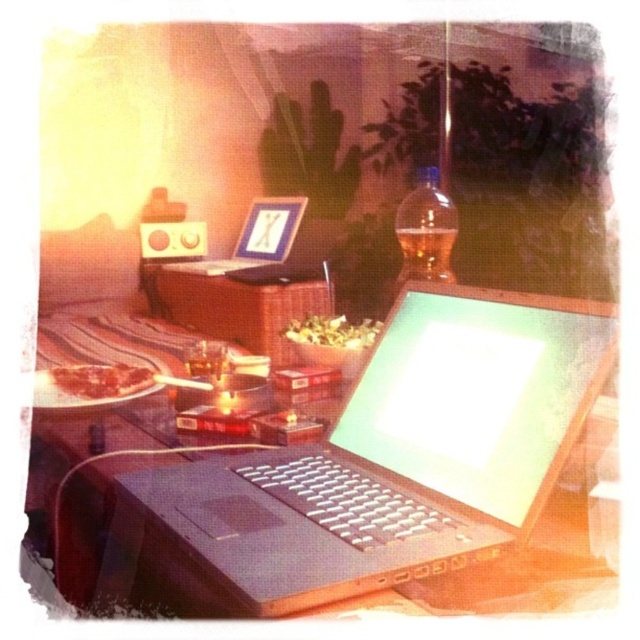
You are organizing a workspace and need to place both the satin black laptop at center and the black matte laptop at center on a shelf. The shelf has a width of 1.2 meters. If the combined width of both laptops is 1 meter, will they fit side by side on the shelf?

The satin black laptop at center is larger than the black matte laptop at center. Since their combined width is 1 meter and the shelf is 1.2 meters wide, they will fit side by side with some space remaining.

You are trying to locate the black matte laptop at center in the image. What are its coordinates?

The black matte laptop at center is located at coordinates point (257, 237).